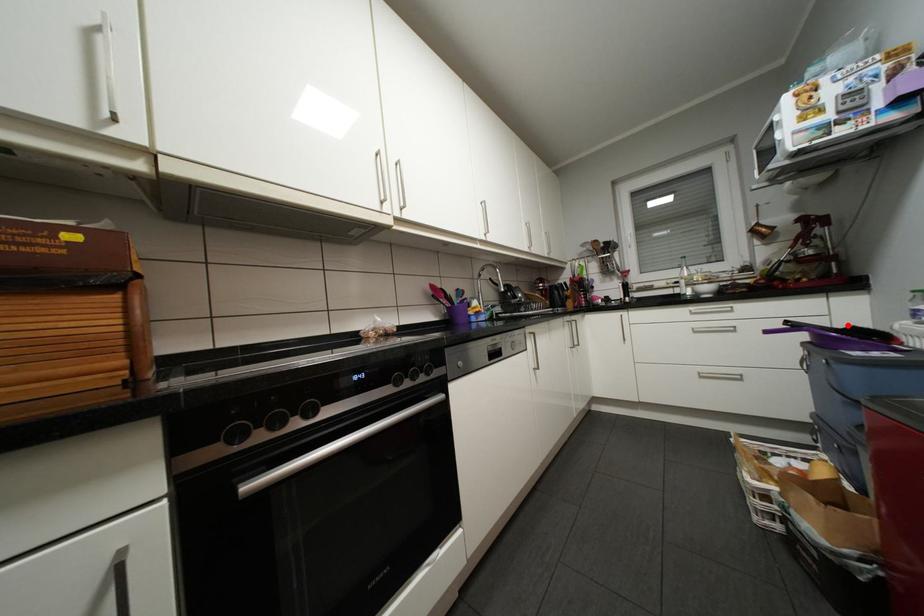
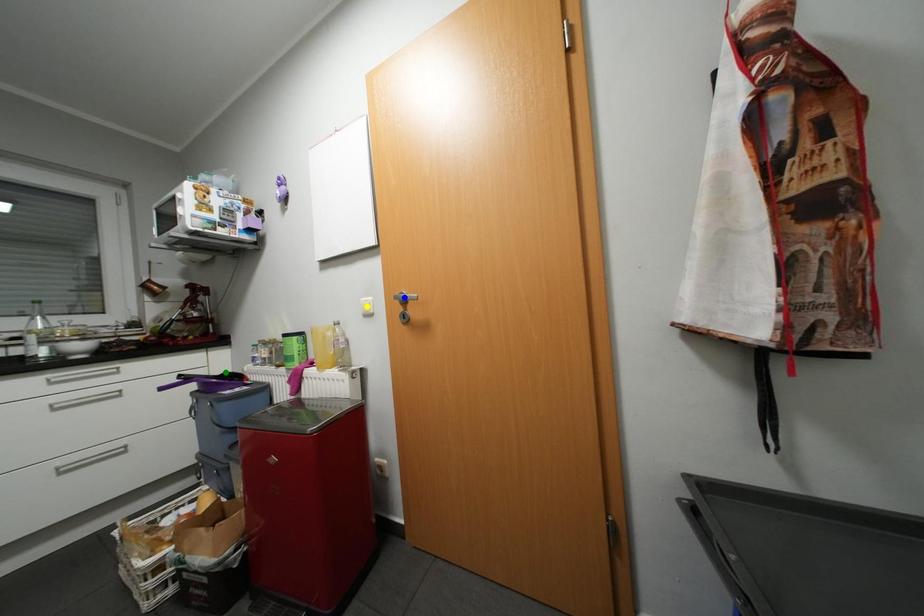
Question: I am providing you with two images of the same scene from different viewpoints. A red point is marked on the first image. You are given multiple points on the second image. Can you choose the point in image 2 that corresponds to the point in image 1?

Choices:
 (A) green point
 (B) yellow point
 (C) blue point

Answer: (A)